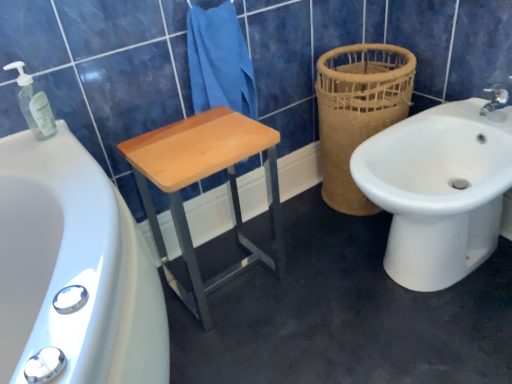
Locate an element on the screen. The image size is (512, 384). free space to the left of brown woven basket at right is located at coordinates (301, 221).